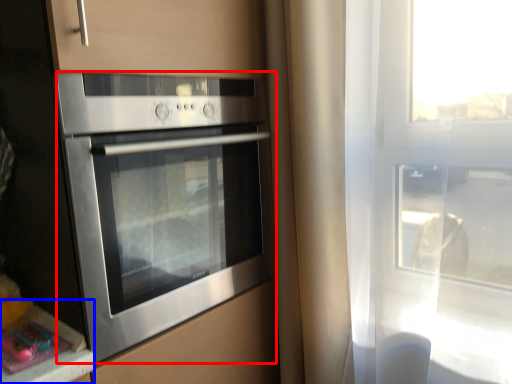
Question: Which object appears farthest to the camera in this image, oven (highlighted by a red box) or counter top (highlighted by a blue box)?

Choices:
 (A) oven
 (B) counter top

Answer: (B)